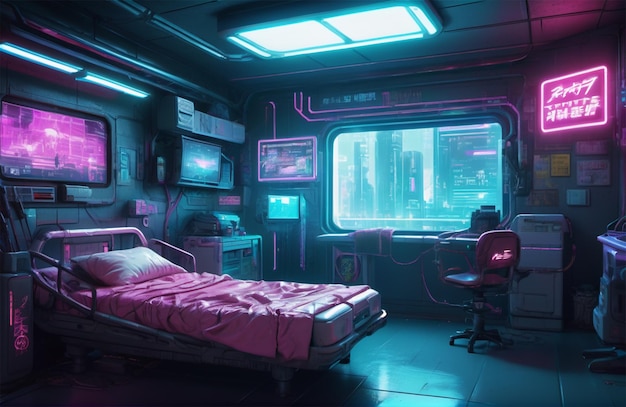
Locate an element on the screen. tile floor is located at coordinates (409, 387).